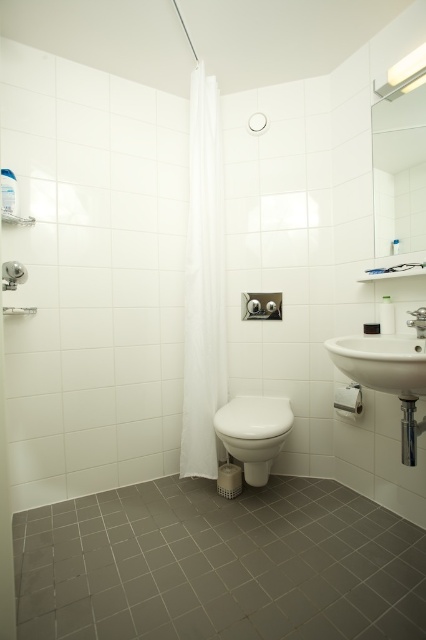
Question: Which point is farther to the camera?

Choices:
 (A) (383, 336)
 (B) (219, 301)
 (C) (233, 448)
 (D) (19, 262)

Answer: (B)

Question: Can you confirm if white sheer curtain at center is positioned below clear glass mirror at upper right?

Choices:
 (A) yes
 (B) no

Answer: (A)

Question: Can you confirm if gray tile at lower center is thinner than white sheer curtain at center?

Choices:
 (A) yes
 (B) no

Answer: (B)

Question: Which object appears farthest from the camera in this image?

Choices:
 (A) white glossy toilet bowl at center
 (B) white ceramic sink at right

Answer: (A)

Question: Which point is closer to the camera?

Choices:
 (A) (3, 269)
 (B) (396, 618)
 (C) (414, 323)

Answer: (B)

Question: Can you confirm if clear glass mirror at upper right is positioned above matte silver faucet at upper right?

Choices:
 (A) yes
 (B) no

Answer: (A)